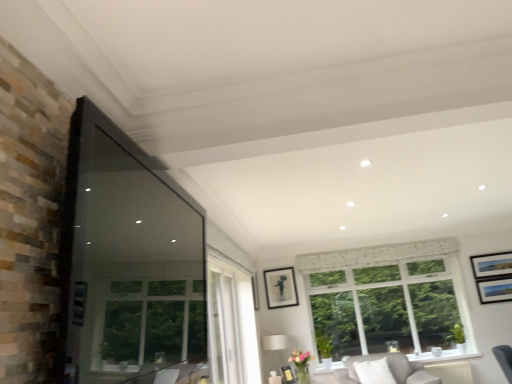
Question: From a real-world perspective, is white lace curtain at upper center over matte white lampshade at center?

Choices:
 (A) yes
 (B) no

Answer: (A)

Question: From a real-world perspective, is white lace curtain at upper center physically below matte white lampshade at center?

Choices:
 (A) yes
 (B) no

Answer: (B)

Question: Is white lace curtain at upper center in contact with matte white lampshade at center?

Choices:
 (A) yes
 (B) no

Answer: (B)

Question: Considering the relative sizes of white lace curtain at upper center and matte white lampshade at center in the image provided, is white lace curtain at upper center taller than matte white lampshade at center?

Choices:
 (A) no
 (B) yes

Answer: (A)

Question: Is white lace curtain at upper center closer to the viewer compared to matte white lampshade at center?

Choices:
 (A) yes
 (B) no

Answer: (B)

Question: Is white lace curtain at upper center not close to matte white lampshade at center?

Choices:
 (A) yes
 (B) no

Answer: (A)

Question: Does white lace curtain at upper center lie behind light gray fabric couch at lower right?

Choices:
 (A) no
 (B) yes

Answer: (B)

Question: Considering the relative sizes of white lace curtain at upper center and light gray fabric couch at lower right in the image provided, is white lace curtain at upper center bigger than light gray fabric couch at lower right?

Choices:
 (A) yes
 (B) no

Answer: (B)

Question: Is white lace curtain at upper center thinner than light gray fabric couch at lower right?

Choices:
 (A) no
 (B) yes

Answer: (B)

Question: Is white lace curtain at upper center facing towards light gray fabric couch at lower right?

Choices:
 (A) yes
 (B) no

Answer: (B)

Question: Considering the relative positions of white lace curtain at upper center and light gray fabric couch at lower right in the image provided, is white lace curtain at upper center to the right of light gray fabric couch at lower right from the viewer's perspective?

Choices:
 (A) yes
 (B) no

Answer: (B)

Question: From a real-world perspective, is white lace curtain at upper center on light gray fabric couch at lower right?

Choices:
 (A) yes
 (B) no

Answer: (A)

Question: Is matte black picture frame at lower center, which is counted as the 3th picture frame, starting from the top, outside transparent glass window screen at left?

Choices:
 (A) no
 (B) yes

Answer: (B)